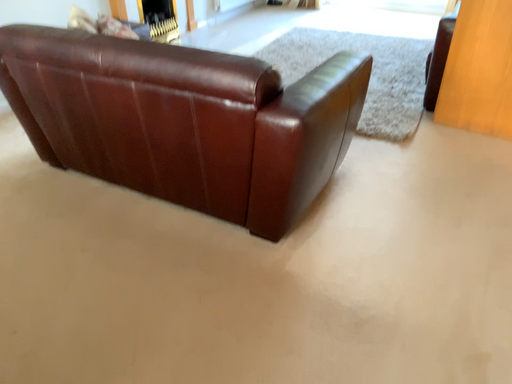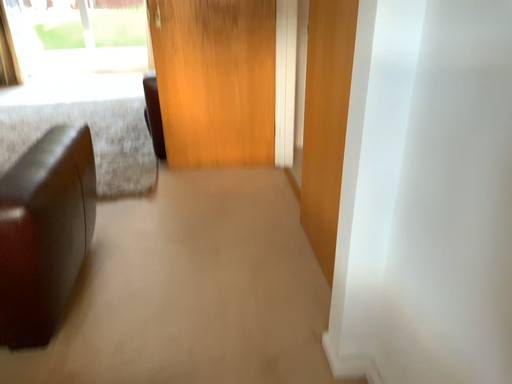
Question: Which way did the camera rotate in the video?

Choices:
 (A) rotated upward
 (B) rotated downward

Answer: (A)